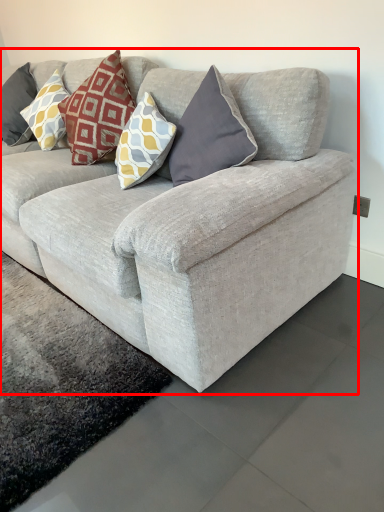
Question: In this image, where is studio couch (annotated by the red box) located relative to pillow?

Choices:
 (A) left
 (B) right

Answer: (B)